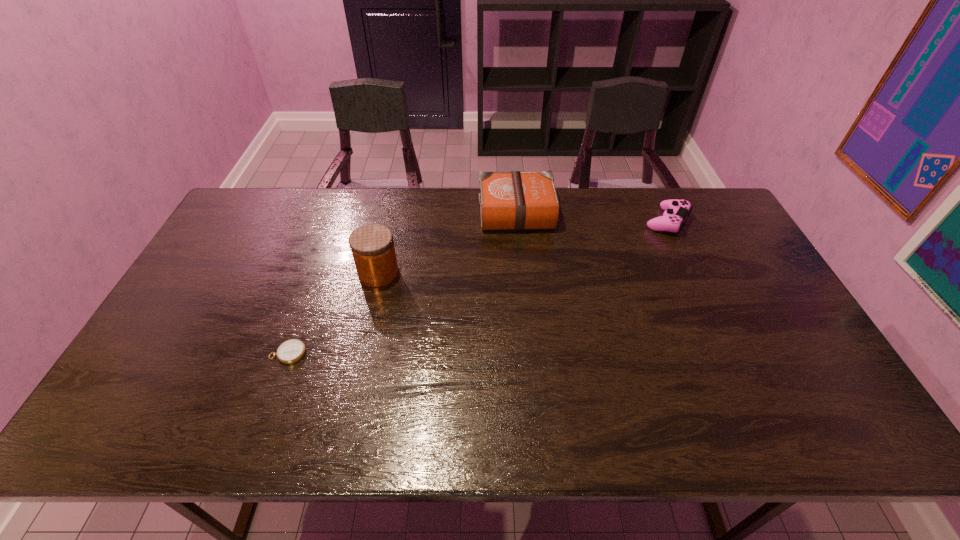
Locate an element on the screen. blank space at the far right corner of the desktop is located at coordinates (695, 228).

I want to click on free space between the nearest object and the Bible, so coord(403,282).

Locate an element on the screen. The width and height of the screenshot is (960, 540). empty space that is in between the Bible and the rightmost object is located at coordinates (592, 217).

Locate an element on the screen. unoccupied position between the compass and the third farthest object is located at coordinates (333, 313).

Where is `blank region between the second object from left to right and the leftmost object`? The image size is (960, 540). blank region between the second object from left to right and the leftmost object is located at coordinates (333, 313).

What are the coordinates of `free space between the rightmost object and the second nearest object` in the screenshot? It's located at (523, 247).

Find the location of `free space between the Bible and the compass`. free space between the Bible and the compass is located at coordinates (403, 282).

The image size is (960, 540). In order to click on vacant area that lies between the tallest object and the control in this screenshot , I will do `click(523, 247)`.

You are a GUI agent. You are given a task and a screenshot of the screen. Output one action in this format:
    pyautogui.click(x=<x>, y=<y>)
    Task: Click on the free area in between the control and the third farthest object
    This screenshot has height=540, width=960.
    Given the screenshot: What is the action you would take?
    (x=523, y=247)

Find the location of `vacant area between the second object from left to right and the compass`. vacant area between the second object from left to right and the compass is located at coordinates (333, 313).